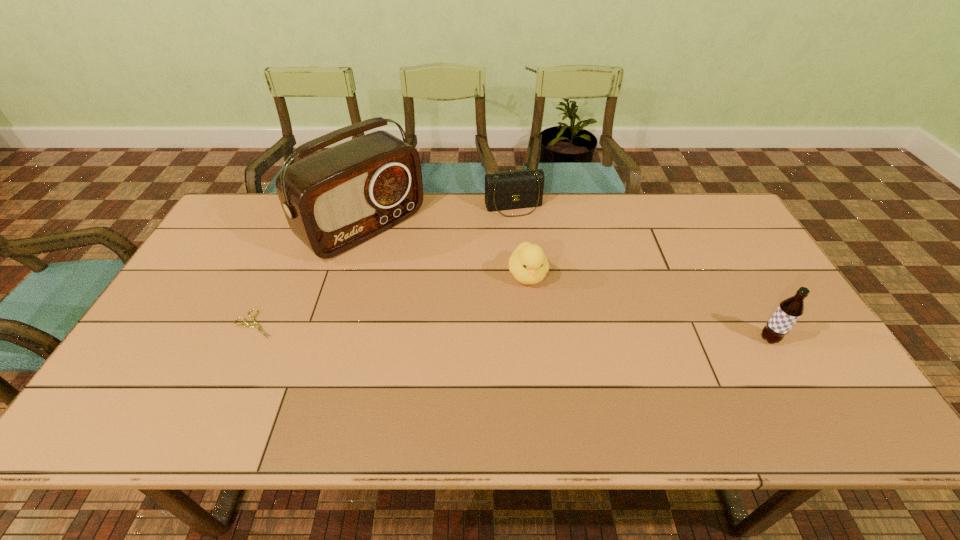
Where is `free spot located 0.340m on the front flap of the clutch bag`? The height and width of the screenshot is (540, 960). free spot located 0.340m on the front flap of the clutch bag is located at coordinates (548, 290).

You are a GUI agent. You are given a task and a screenshot of the screen. Output one action in this format:
    pyautogui.click(x=<x>, y=<y>)
    Task: Click on the free location located 0.170m on the front panel of the tallest object
    
    Given the screenshot: What is the action you would take?
    pyautogui.click(x=436, y=285)

The height and width of the screenshot is (540, 960). What are the coordinates of `free location located 0.330m on the front panel of the tallest object` in the screenshot? It's located at (474, 316).

Identify the location of vacant space located on the front panel of the tallest object. (444, 292).

The image size is (960, 540). Identify the location of vacant space located on the front-facing side of the duck. (x=558, y=380).

I want to click on free space located 0.060m on the front-facing side of the duck, so click(538, 309).

At what (x,y) coordinates should I click in order to perform the action: click on vacant area situated 0.190m on the front-facing side of the duck. Please return your answer as a coordinate pair (x, y). Looking at the image, I should click on (549, 349).

This screenshot has width=960, height=540. In order to click on clutch bag located at the far edge in this screenshot , I will do `click(507, 190)`.

Locate an element on the screen. radio receiver positioned at the far edge is located at coordinates (334, 200).

At what (x,y) coordinates should I click in order to perform the action: click on object situated at the right edge. Please return your answer as a coordinate pair (x, y). This screenshot has width=960, height=540. Looking at the image, I should click on (789, 311).